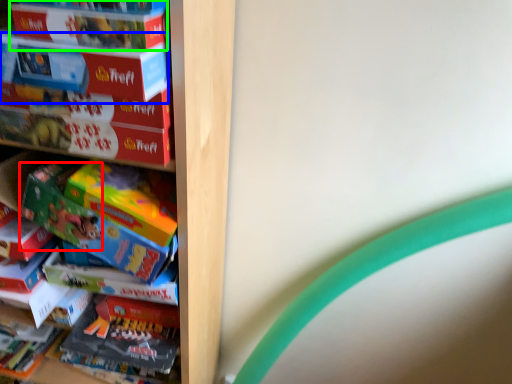
Question: Based on their relative distances, which object is nearer to toy (highlighted by a red box)? Choose from paperback book (highlighted by a blue box) and paperback book (highlighted by a green box).

Choices:
 (A) paperback book
 (B) paperback book

Answer: (A)